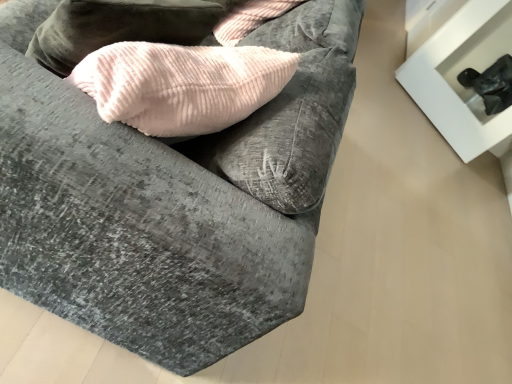
Describe the element at coordinates (458, 73) in the screenshot. This screenshot has width=512, height=384. I see `black matte table at upper right` at that location.

Identify the location of black matte table at upper right. (458, 73).

At what (x,y) coordinates should I click in order to perform the action: click on velvet gray couch at center. Please return your answer as a coordinate pair (x, y). The height and width of the screenshot is (384, 512). Looking at the image, I should click on (170, 198).

What do you see at coordinates (170, 198) in the screenshot? I see `velvet gray couch at center` at bounding box center [170, 198].

The width and height of the screenshot is (512, 384). Find the location of `black matte table at upper right`. black matte table at upper right is located at coordinates (458, 73).

Considering the positions of objects velvet gray couch at center and black matte table at upper right in the image provided, who is more to the left, velvet gray couch at center or black matte table at upper right?

From the viewer's perspective, velvet gray couch at center appears more on the left side.

Between velvet gray couch at center and black matte table at upper right, which one is positioned behind?

black matte table at upper right.

Which is closer, [264,233] or [456,103]?

Point [264,233] is closer to the camera than point [456,103].

From the image's perspective, is velvet gray couch at center over black matte table at upper right?

No.

From a real-world perspective, which is physically below, velvet gray couch at center or black matte table at upper right?

velvet gray couch at center, from a real-world perspective.

Does velvet gray couch at center have a greater width compared to black matte table at upper right?

Result: Correct, the width of velvet gray couch at center exceeds that of black matte table at upper right.

Does velvet gray couch at center have a greater height compared to black matte table at upper right?

No, velvet gray couch at center is not taller than black matte table at upper right.

Considering the sizes of objects velvet gray couch at center and black matte table at upper right in the image provided, who is smaller, velvet gray couch at center or black matte table at upper right?

Smaller between the two is black matte table at upper right.

Is black matte table at upper right surrounded by velvet gray couch at center?

Actually, black matte table at upper right is outside velvet gray couch at center.

Consider the image. Are velvet gray couch at center and black matte table at upper right far apart?

velvet gray couch at center is far away from black matte table at upper right.

Is velvet gray couch at center positioned with its back to black matte table at upper right?

That's not correct — velvet gray couch at center is not looking away from black matte table at upper right.

The height and width of the screenshot is (384, 512). Identify the location of studio couch on the left of black matte table at upper right. (170, 198).

Visually, is black matte table at upper right positioned to the left or to the right of velvet gray couch at center?

black matte table at upper right is positioned on velvet gray couch at center's right side.

Which object is further away from the camera taking this photo, black matte table at upper right or velvet gray couch at center?

black matte table at upper right is further away from the camera.

Between point (509, 29) and point (16, 193), which one is positioned in front?

The point (16, 193) is more forward.

From the image's perspective, would you say black matte table at upper right is shown under velvet gray couch at center?

No.

From a real-world perspective, is black matte table at upper right located higher than velvet gray couch at center?

Yes, from a real-world perspective, black matte table at upper right is over velvet gray couch at center

Considering the relative sizes of black matte table at upper right and velvet gray couch at center in the image provided, is black matte table at upper right thinner than velvet gray couch at center?

Indeed, black matte table at upper right has a lesser width compared to velvet gray couch at center.

Between black matte table at upper right and velvet gray couch at center, which one has more height?

black matte table at upper right is taller.

Between black matte table at upper right and velvet gray couch at center, which one has smaller size?

black matte table at upper right.

Is velvet gray couch at center surrounded by black matte table at upper right?

No, black matte table at upper right does not contain velvet gray couch at center.

Based on the photo, is black matte table at upper right placed right next to velvet gray couch at center?

No, black matte table at upper right is not next to velvet gray couch at center.

Is black matte table at upper right oriented away from velvet gray couch at center?

No, black matte table at upper right is not facing the opposite direction of velvet gray couch at center.

Measure the distance from black matte table at upper right to velvet gray couch at center.

black matte table at upper right and velvet gray couch at center are 2.29 meters apart from each other.

I want to click on furniture located on the right of velvet gray couch at center, so click(x=458, y=73).

Identify the location of furniture above the velvet gray couch at center (from the image's perspective). (458, 73).

You are a GUI agent. You are given a task and a screenshot of the screen. Output one action in this format:
    pyautogui.click(x=<x>, y=<y>)
    Task: Click on the furniture on the right of velvet gray couch at center
    The height and width of the screenshot is (384, 512).
    Given the screenshot: What is the action you would take?
    pyautogui.click(x=458, y=73)